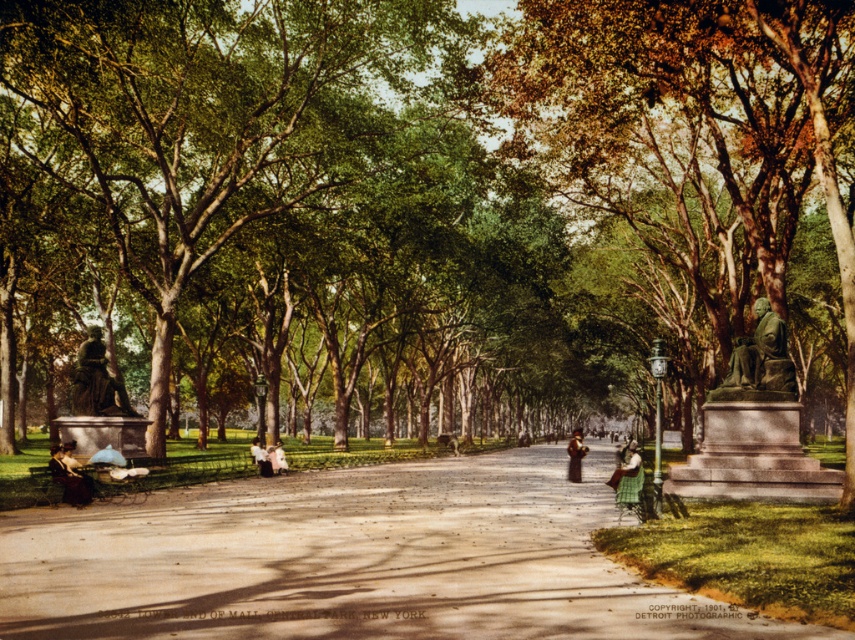
You are a photographer planning to take a photo of the green fabric dress at center and the dark brown coat at center. Since you want to ensure both are clearly visible, which object should you focus on first to account for their sizes?

The green fabric dress at center is smaller than the dark brown coat at center, so you should focus on the green fabric dress at center first to ensure its details are captured clearly before adjusting for the larger coat.

You are standing at the central pathway in the park and see two points marked in the image. Which of the two points, point (91, 396) or point (282, 461), is closer to you?

Point (91, 396) is closer to the viewer than point (282, 461).